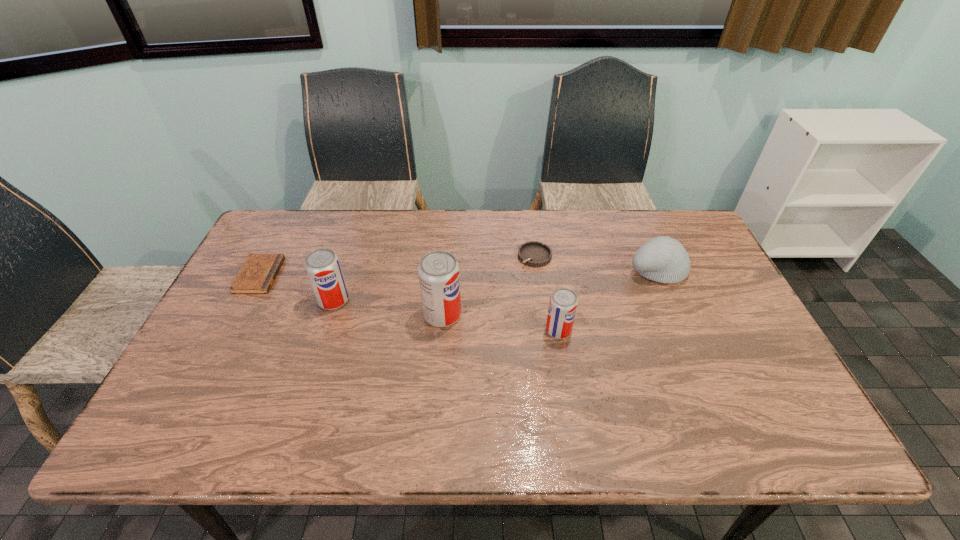
Identify the location of vacant space that satisfies the following two spatial constraints: 1. on the spine side of the second tallest soda; 2. on the left side of the shortest object. (247, 300).

At what (x,y) coordinates should I click in order to perform the action: click on vacant space that satisfies the following two spatial constraints: 1. on the front side of the rightmost object; 2. on the spine side of the leftmost object. Please return your answer as a coordinate pair (x, y). The width and height of the screenshot is (960, 540). Looking at the image, I should click on (659, 275).

Find the location of a particular element. Image resolution: width=960 pixels, height=540 pixels. vacant space that satisfies the following two spatial constraints: 1. on the spine side of the diary; 2. on the right side of the rightmost soda is located at coordinates (230, 330).

Identify the location of vacant space that satisfies the following two spatial constraints: 1. on the spine side of the shortest object; 2. on the back side of the fifth object from right to left. (247, 300).

This screenshot has width=960, height=540. What are the coordinates of `free spot that satisfies the following two spatial constraints: 1. on the back side of the leftmost soda; 2. on the spine side of the shortest object` in the screenshot? It's located at (342, 275).

Locate an element on the screen. This screenshot has height=540, width=960. vacant space that satisfies the following two spatial constraints: 1. on the back side of the rightmost object; 2. on the right side of the fourth object from right to left is located at coordinates (446, 269).